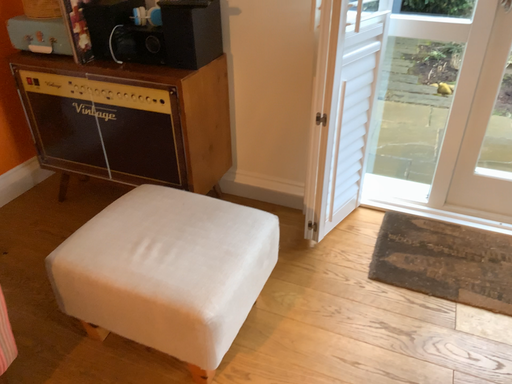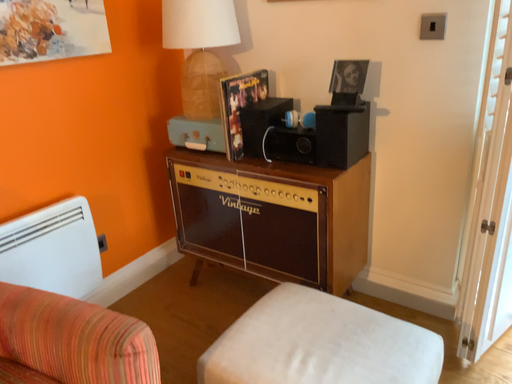
Question: How did the camera likely rotate when shooting the video?

Choices:
 (A) rotated right
 (B) rotated left

Answer: (B)